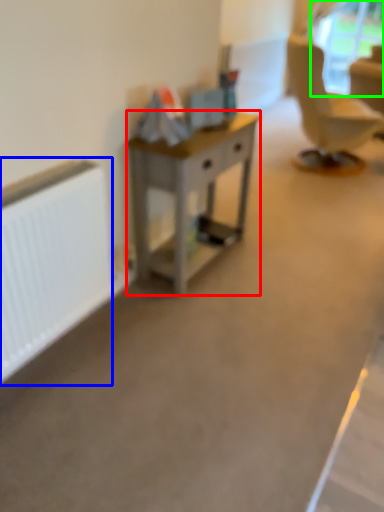
Question: Estimate the real-world distances between objects in this image. Which object is closer to desk (highlighted by a red box), radiator (highlighted by a blue box) or window screen (highlighted by a green box)?

Choices:
 (A) radiator
 (B) window screen

Answer: (A)